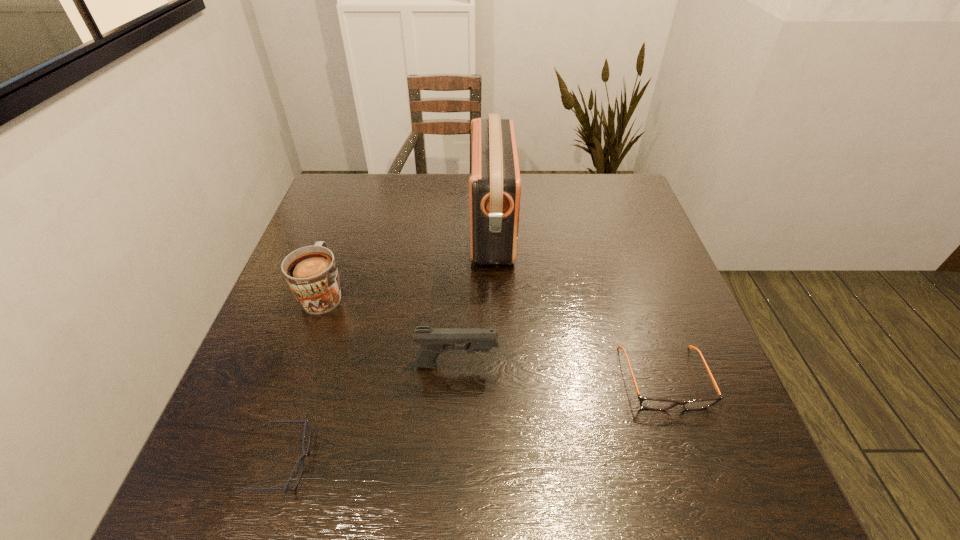
Where is `unoccupied position between the tallest object and the nearest object`? Image resolution: width=960 pixels, height=540 pixels. unoccupied position between the tallest object and the nearest object is located at coordinates (387, 346).

You are a GUI agent. You are given a task and a screenshot of the screen. Output one action in this format:
    pyautogui.click(x=<x>, y=<y>)
    Task: Click on the free space that is in between the radio receiver and the nearest object
    This screenshot has width=960, height=540.
    Given the screenshot: What is the action you would take?
    pyautogui.click(x=387, y=346)

The image size is (960, 540). I want to click on vacant area between the nearer spectacles and the radio receiver, so click(x=387, y=346).

Identify the location of blank region between the radio receiver and the pistol. Image resolution: width=960 pixels, height=540 pixels. (474, 296).

Locate an element on the screen. The image size is (960, 540). free space that is in between the farther spectacles and the pistol is located at coordinates (561, 372).

Identify the location of vacant point located between the pistol and the nearest object. (370, 414).

You are a GUI agent. You are given a task and a screenshot of the screen. Output one action in this format:
    pyautogui.click(x=<x>, y=<y>)
    Task: Click on the free space between the pistol and the rightmost object
    
    Given the screenshot: What is the action you would take?
    pyautogui.click(x=561, y=372)

The image size is (960, 540). I want to click on free area in between the radio receiver and the pistol, so click(x=474, y=296).

Locate an element on the screen. Image resolution: width=960 pixels, height=540 pixels. object that can be found as the fourth closest to the pistol is located at coordinates (495, 184).

This screenshot has height=540, width=960. I want to click on object that stands as the closest to the tallest object, so click(x=433, y=342).